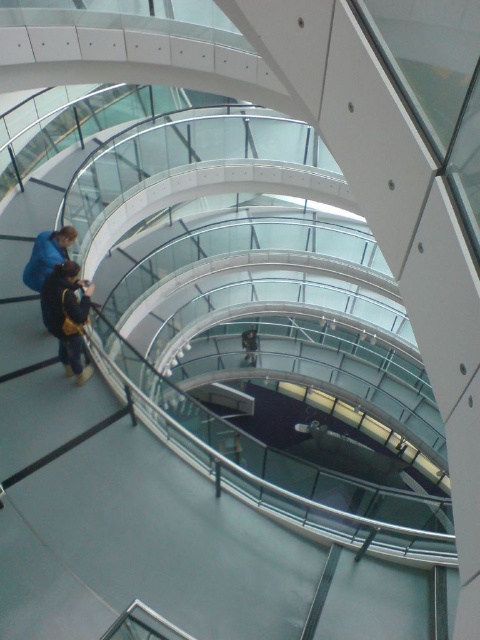
You are standing at the entrance of the building and see the dark brown leather jacket at lower left and the black fabric person at center. Which object is closer to you?

The dark brown leather jacket at lower left is closer to you because it is in front of the black fabric person at center.

You are standing at the base of the spiral staircase in the modern building. You see a dark brown leather jacket at lower left and a black fabric person at center. If you want to walk from the jacket to the person, will you have to climb any stairs?

The distance between the dark brown leather jacket at lower left and the black fabric person at center is 55.62 feet. Since both objects are at the same level, you won not need to climb any stairs to walk from the jacket to the person.

You are standing in the modern building and see the dark brown leather jacket at lower left and the black fabric person at center. Which object is positioned more to the left side of the scene?

The dark brown leather jacket at lower left is positioned more to the left side of the scene than the black fabric person at center.